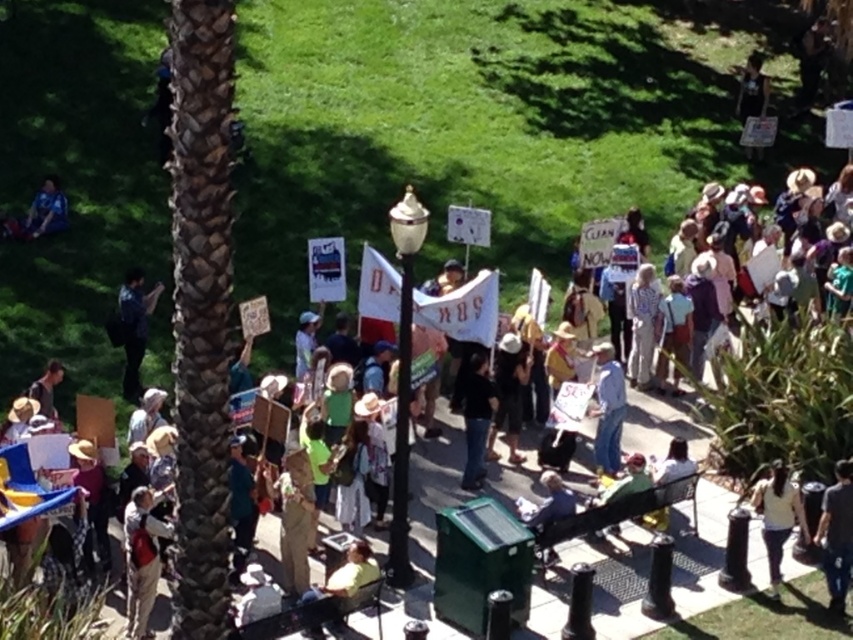
You are a photographer trying to capture the protest scene. You notice the blue jeans at center in the image. Based on its position, can you estimate whether it is closer to the front or the back of the group?

The blue jeans at center is located at point coordinates that place it centrally within the scene, but without additional spatial references, it is impossible to determine if it is at the front or back of the group.